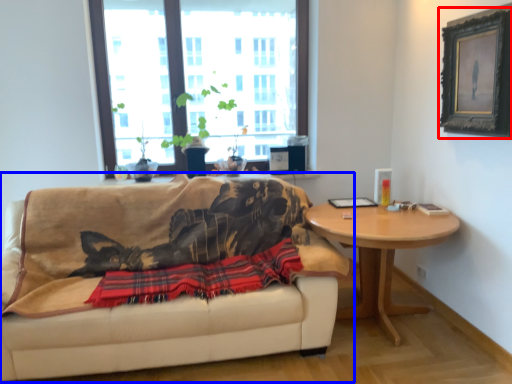
Question: Among these objects, which one is farthest to the camera, picture frame (highlighted by a red box) or studio couch (highlighted by a blue box)?

Choices:
 (A) picture frame
 (B) studio couch

Answer: (A)